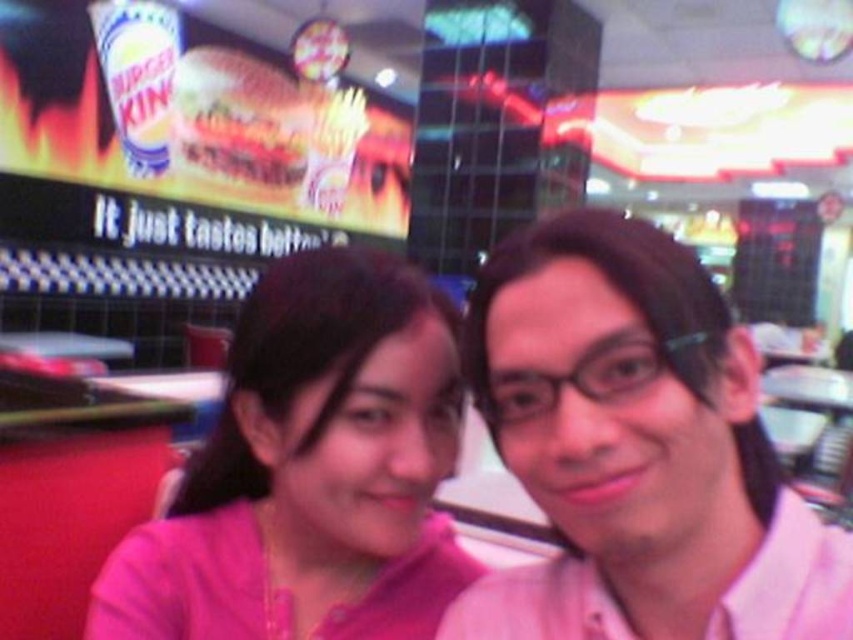
You are sitting at a table in the Burger King restaurant shown in the image. There are two points marked on the table. The first point is at coordinates point (561, 317) and the second point is at point (292, 355). If you want to place a small salt shaker at the point that is closer to you, which point should you choose?

Point (561, 317) is in front of point (292, 355), so you should place the salt shaker at point (561, 317) because it is closer to you.

Consider the image. You are a fashion designer observing two shirts in the image. The pink matte shirt at center and the pink fabric shirt at center. Which one has a narrower width?

The pink matte shirt at center is thinner than the pink fabric shirt at center, so the pink matte shirt at center has a narrower width.

You are a photographer taking a picture of two people sitting at a table in a Burger King restaurant. You notice the pink matte shirt at center and the pink fabric shirt at center. Which shirt is closer to the camera?

The pink matte shirt at center is closer to the camera because it is in front of the pink fabric shirt at center.